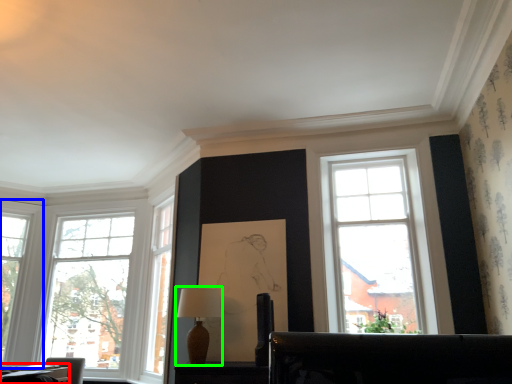
Question: Based on their relative distances, which object is farther from table (highlighted by a red box)? Choose from window (highlighted by a blue box) and table lamp (highlighted by a green box).

Choices:
 (A) window
 (B) table lamp

Answer: (B)